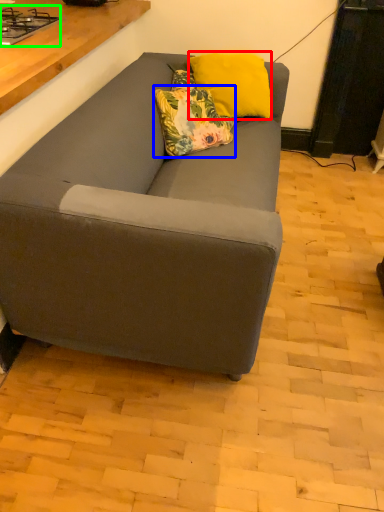
Question: Based on their relative distances, which object is nearer to pillow (highlighted by a red box)? Choose from pillow (highlighted by a blue box) and gas stove (highlighted by a green box).

Choices:
 (A) pillow
 (B) gas stove

Answer: (A)